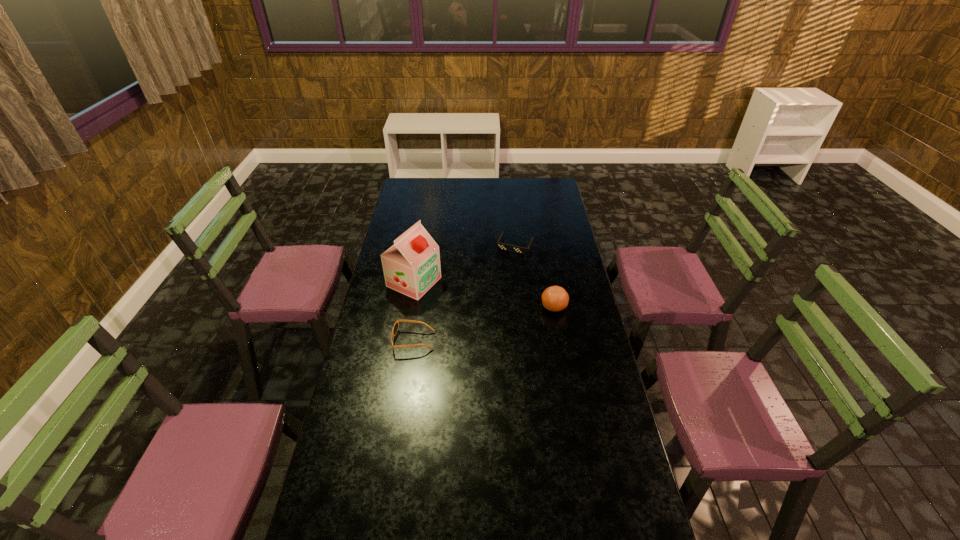
I want to click on the taller sunglasses, so click(395, 328).

The image size is (960, 540). In order to click on the third tallest object in this screenshot , I will do `click(395, 328)`.

Find the location of a particular element. clementine is located at coordinates (555, 298).

What are the coordinates of `the tallest object` in the screenshot? It's located at (411, 266).

Where is `the right sunglasses`? the right sunglasses is located at coordinates (505, 247).

The height and width of the screenshot is (540, 960). Find the location of `the shorter sunglasses`. the shorter sunglasses is located at coordinates 505,247.

Identify the location of free space located 0.050m on the front-facing side of the left sunglasses. The height and width of the screenshot is (540, 960). (380, 341).

Where is `free location located 0.110m on the front-facing side of the left sunglasses`? The image size is (960, 540). free location located 0.110m on the front-facing side of the left sunglasses is located at coordinates (365, 341).

This screenshot has height=540, width=960. Find the location of `free space located 0.080m on the front-facing side of the left sunglasses`. free space located 0.080m on the front-facing side of the left sunglasses is located at coordinates (372, 341).

Identify the location of vacant space located on the front of the clementine. The image size is (960, 540). (560, 337).